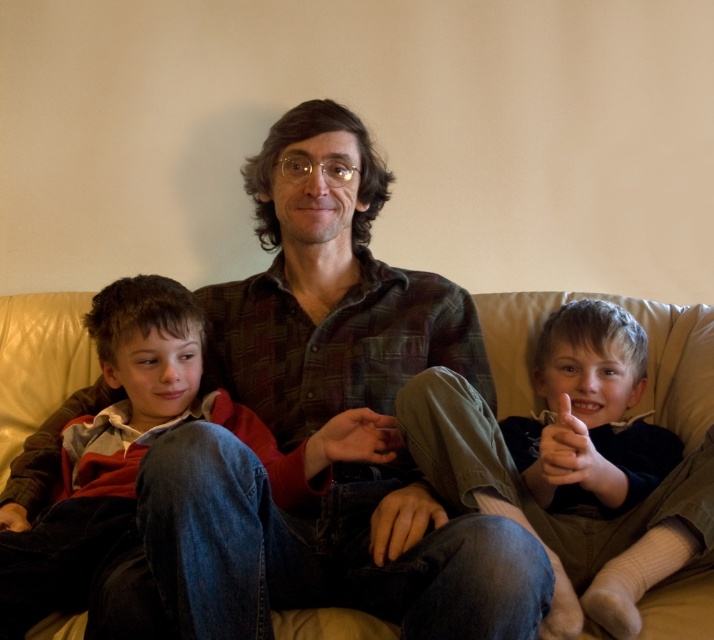
Question: Which object is closer to the camera taking this photo?

Choices:
 (A) beige leather couch at center
 (B) light brown cotton pants at right

Answer: (B)

Question: Which of the following is the closest to the observer?

Choices:
 (A) light brown cotton pants at right
 (B) beige leather couch at center

Answer: (A)

Question: Is light brown cotton pants at right to the left of beige leather couch at center from the viewer's perspective?

Choices:
 (A) yes
 (B) no

Answer: (A)

Question: Is light brown cotton pants at right further to the viewer compared to beige leather couch at center?

Choices:
 (A) no
 (B) yes

Answer: (A)

Question: Which point is closer to the camera taking this photo?

Choices:
 (A) (688, 602)
 (B) (560, 560)

Answer: (A)

Question: Does light brown cotton pants at right come in front of beige leather couch at center?

Choices:
 (A) no
 (B) yes

Answer: (B)